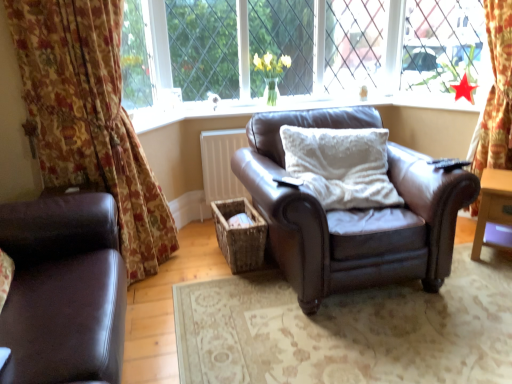
Question: Does floral fabric curtain at left appear on the right side of white fluffy pillow at center?

Choices:
 (A) no
 (B) yes

Answer: (A)

Question: Is floral fabric curtain at left positioned before white fluffy pillow at center?

Choices:
 (A) yes
 (B) no

Answer: (A)

Question: Considering the relative sizes of floral fabric curtain at left and white fluffy pillow at center in the image provided, is floral fabric curtain at left wider than white fluffy pillow at center?

Choices:
 (A) yes
 (B) no

Answer: (B)

Question: Would you say floral fabric curtain at left is a long distance from white fluffy pillow at center?

Choices:
 (A) no
 (B) yes

Answer: (B)

Question: Is floral fabric curtain at left taller than white fluffy pillow at center?

Choices:
 (A) yes
 (B) no

Answer: (A)

Question: Is floral fabric curtain at left further to camera compared to white fluffy pillow at center?

Choices:
 (A) yes
 (B) no

Answer: (B)

Question: Is floral fabric curtain at left placed right next to matte brown leather armchair at center?

Choices:
 (A) no
 (B) yes

Answer: (A)

Question: Is floral fabric curtain at left facing towards matte brown leather armchair at center?

Choices:
 (A) no
 (B) yes

Answer: (A)

Question: Is floral fabric curtain at left closer to camera compared to matte brown leather armchair at center?

Choices:
 (A) yes
 (B) no

Answer: (A)

Question: Does floral fabric curtain at left have a lesser width compared to matte brown leather armchair at center?

Choices:
 (A) yes
 (B) no

Answer: (B)

Question: Can matte brown leather armchair at center be found inside floral fabric curtain at left?

Choices:
 (A) yes
 (B) no

Answer: (B)

Question: From the image's perspective, is floral fabric curtain at left on top of matte brown leather armchair at center?

Choices:
 (A) no
 (B) yes

Answer: (A)

Question: Is woven brown basket at center smaller than wooden side table at right?

Choices:
 (A) yes
 (B) no

Answer: (A)